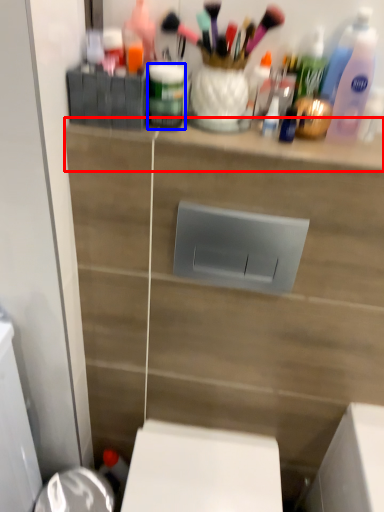
Question: Which object is further to the camera taking this photo, ledge (highlighted by a red box) or toiletry (highlighted by a blue box)?

Choices:
 (A) ledge
 (B) toiletry

Answer: (B)